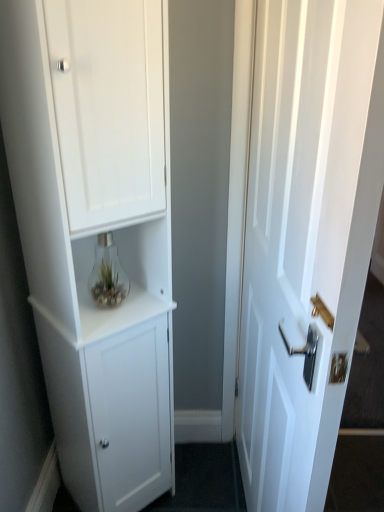
Locate an element on the screen. This screenshot has width=384, height=512. white matte cabinet at left is located at coordinates (96, 231).

What do you see at coordinates (96, 231) in the screenshot? I see `white matte cabinet at left` at bounding box center [96, 231].

What do you see at coordinates (306, 238) in the screenshot?
I see `white glossy door at right` at bounding box center [306, 238].

Find the location of a particular element. Image resolution: width=384 pixels, height=512 pixels. white glossy door at right is located at coordinates (306, 238).

The width and height of the screenshot is (384, 512). In order to click on white matte cabinet at left in this screenshot , I will do `click(96, 231)`.

Which is more to the left, white matte cabinet at left or white glossy door at right?

From the viewer's perspective, white matte cabinet at left appears more on the left side.

Between white matte cabinet at left and white glossy door at right, which one is positioned behind?

white matte cabinet at left is further away from the camera.

Considering the points (152, 115) and (241, 327), which point is in front, point (152, 115) or point (241, 327)?

Point (152, 115)

From the image's perspective, is white matte cabinet at left positioned above or below white glossy door at right?

Clearly, from the image's perspective, white matte cabinet at left is above white glossy door at right.

From a real-world perspective, is white matte cabinet at left positioned over white glossy door at right based on gravity?

Yes, from a real-world perspective, white matte cabinet at left is above white glossy door at right.

Can you confirm if white matte cabinet at left is wider than white glossy door at right?

Yes.

Based on the photo, between white matte cabinet at left and white glossy door at right, which one has less height?

Standing shorter between the two is white glossy door at right.

Between white matte cabinet at left and white glossy door at right, which one has larger size?

white matte cabinet at left.

Would you say white matte cabinet at left contains white glossy door at right?

No, white glossy door at right is not surrounded by white matte cabinet at left.

Is white matte cabinet at left placed right next to white glossy door at right?

No, white matte cabinet at left is not with white glossy door at right.

Is white matte cabinet at left aimed at white glossy door at right?

Yes.

What's the angular difference between white matte cabinet at left and white glossy door at right's facing directions?

53.7 degrees.

Where is `door below the white matte cabinet at left (from the image's perspective)`? This screenshot has height=512, width=384. door below the white matte cabinet at left (from the image's perspective) is located at coordinates (306, 238).

Between white glossy door at right and white matte cabinet at left, which one appears on the left side from the viewer's perspective?

white matte cabinet at left is more to the left.

Considering the positions of objects white glossy door at right and white matte cabinet at left in the image provided, who is behind, white glossy door at right or white matte cabinet at left?

white matte cabinet at left is behind.

Which is in front, point (368, 203) or point (124, 51)?

Positioned in front is point (368, 203).

From the image's perspective, between white glossy door at right and white matte cabinet at left, which one is located above?

white matte cabinet at left is shown above in the image.

From a real-world perspective, does white glossy door at right sit lower than white matte cabinet at left?

Yes, from a real-world perspective, white glossy door at right is below white matte cabinet at left.

Considering the relative sizes of white glossy door at right and white matte cabinet at left in the image provided, is white glossy door at right wider than white matte cabinet at left?

No, white glossy door at right is not wider than white matte cabinet at left.

Who is shorter, white glossy door at right or white matte cabinet at left?

white glossy door at right.

Looking at the image, does white glossy door at right seem bigger or smaller compared to white matte cabinet at left?

white glossy door at right is smaller than white matte cabinet at left.

Is white matte cabinet at left surrounded by white glossy door at right?

No, white matte cabinet at left is not inside white glossy door at right.

Is white glossy door at right directly adjacent to white matte cabinet at left?

No, white glossy door at right is not beside white matte cabinet at left.

Is white glossy door at right positioned with its back to white matte cabinet at left?

Correct, white glossy door at right is looking away from white matte cabinet at left.

What are the coordinates of `door on the right of the white matte cabinet at left` in the screenshot? It's located at (306, 238).

Locate an element on the screen. cupboard that is above the white glossy door at right (from the image's perspective) is located at coordinates (96, 231).

Locate an element on the screen. This screenshot has height=512, width=384. door lying below the white matte cabinet at left (from the image's perspective) is located at coordinates (306, 238).